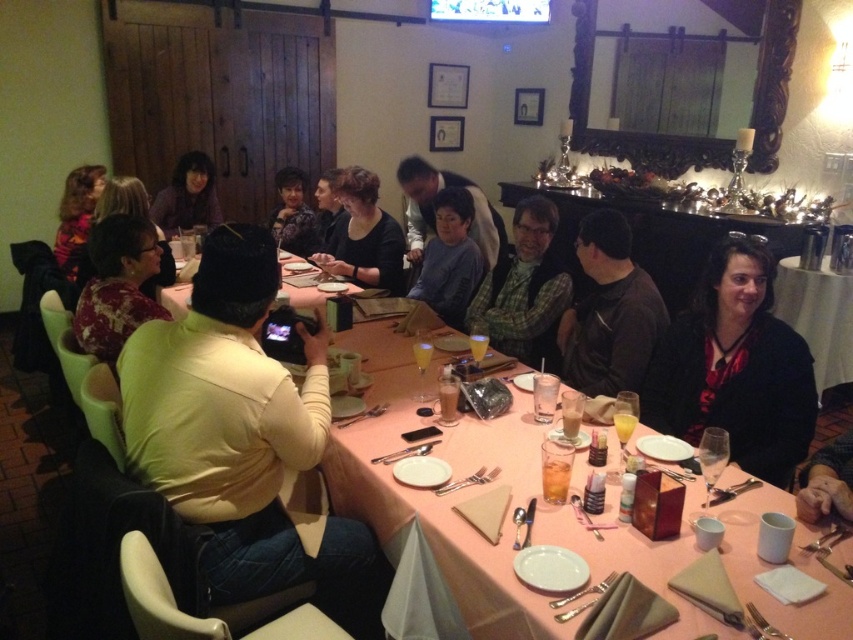
Looking at this image, does black matte jacket at lower right appear under printed fabric blouse at left?

Indeed, black matte jacket at lower right is positioned under printed fabric blouse at left.

Is black matte jacket at lower right shorter than printed fabric blouse at left?

No.

Locate an element on the screen. Image resolution: width=853 pixels, height=640 pixels. black matte jacket at lower right is located at coordinates (735, 368).

Looking at this image, does light brown leather jacket at center appear over pink fabric table at center?

Yes.

Can you confirm if light brown leather jacket at center is positioned below pink fabric table at center?

Actually, light brown leather jacket at center is above pink fabric table at center.

What do you see at coordinates (242, 436) in the screenshot? I see `light brown leather jacket at center` at bounding box center [242, 436].

You are a GUI agent. You are given a task and a screenshot of the screen. Output one action in this format:
    pyautogui.click(x=<x>, y=<y>)
    Task: Click on the light brown leather jacket at center
    This screenshot has height=640, width=853.
    Given the screenshot: What is the action you would take?
    pyautogui.click(x=242, y=436)

Does matte black table at lower right have a greater width compared to matte purple shirt at upper left?

Yes.

Does matte black table at lower right have a lesser width compared to matte purple shirt at upper left?

Incorrect, matte black table at lower right's width is not less than matte purple shirt at upper left's.

Is point (851, 289) closer to viewer compared to point (187, 227)?

Yes, it is in front of point (187, 227).

In order to click on matte black table at lower right in this screenshot , I will do (817, 316).